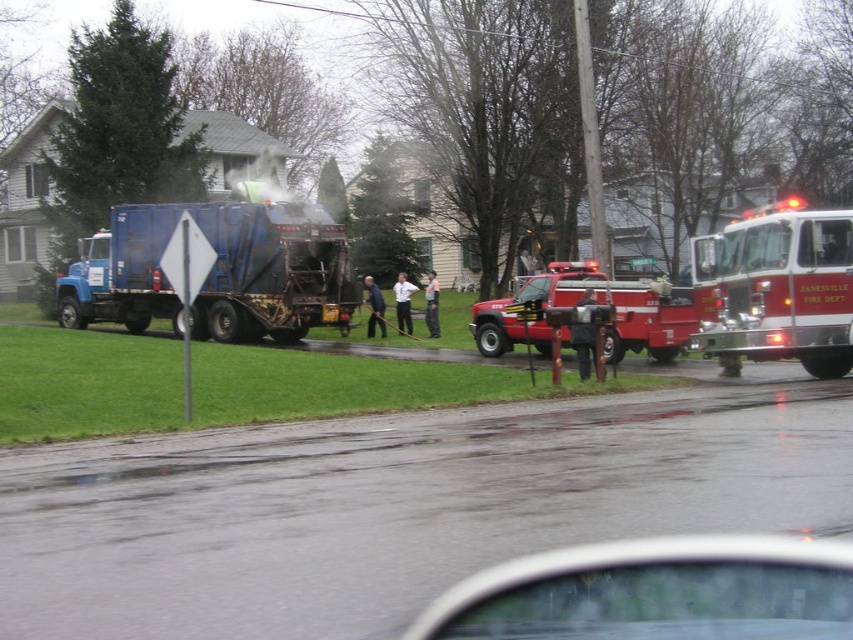
Which is above, blue metallic garbage truck at left or red matte fire truck at center?

blue metallic garbage truck at left is above.

Does blue metallic garbage truck at left appear on the left side of red matte fire truck at center?

Indeed, blue metallic garbage truck at left is positioned on the left side of red matte fire truck at center.

Which is behind, point (251, 280) or point (664, 312)?

The point (251, 280) is more distant.

Where is `blue metallic garbage truck at left`? The width and height of the screenshot is (853, 640). blue metallic garbage truck at left is located at coordinates (215, 272).

Is clear glass windshield at center in front of blue metallic garbage truck at left?

That is True.

Can you confirm if clear glass windshield at center is smaller than blue metallic garbage truck at left?

Yes, clear glass windshield at center is smaller than blue metallic garbage truck at left.

Which is in front, point (511, 627) or point (299, 214)?

Point (511, 627)

Find the location of a particular element. This screenshot has height=640, width=853. clear glass windshield at center is located at coordinates (654, 592).

From the picture: Can you confirm if clear glass windshield at center is positioned above red matte fire truck at center?

Actually, clear glass windshield at center is below red matte fire truck at center.

Who is more forward, (584, 593) or (479, 333)?

Point (584, 593) is in front.

In order to click on clear glass windshield at center in this screenshot , I will do 654,592.